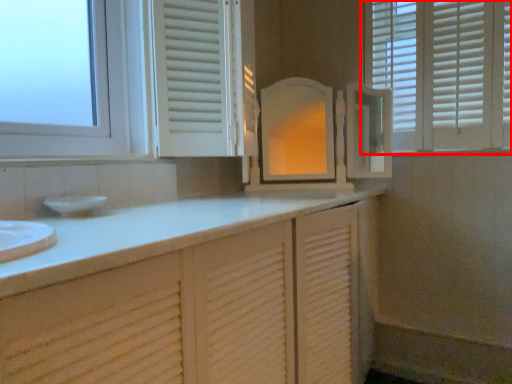
Question: From the image, what is the correct spatial relationship of window (annotated by the red box) in relation to window sill?

Choices:
 (A) left
 (B) right

Answer: (B)